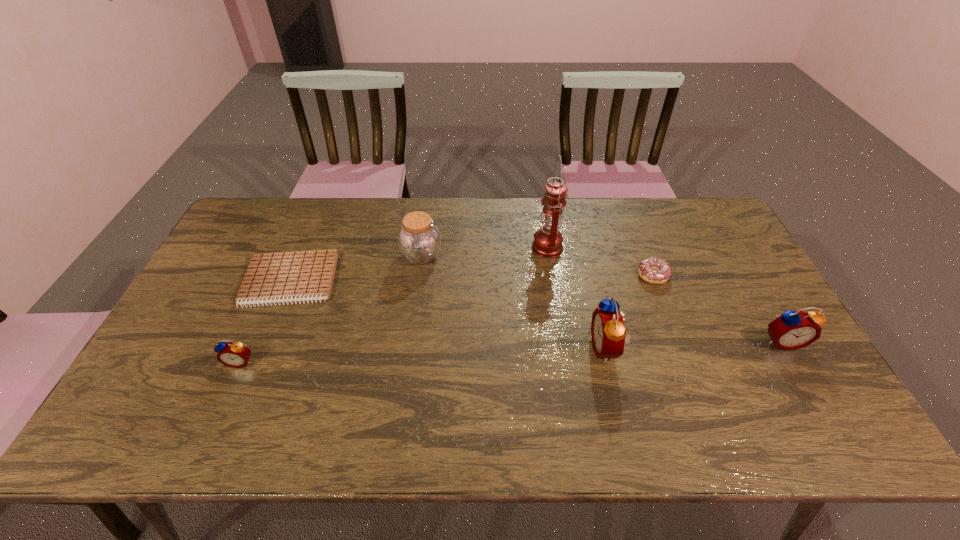
Locate an element on the screen. This screenshot has width=960, height=540. the third object from left to right is located at coordinates (419, 240).

Locate an element on the screen. The image size is (960, 540). free space located on the front-facing side of the second alarm clock from left to right is located at coordinates (554, 348).

I want to click on free space located 0.100m on the front-facing side of the second alarm clock from left to right, so [554, 348].

Find the location of `vacant space located on the front-facing side of the second alarm clock from left to right`. vacant space located on the front-facing side of the second alarm clock from left to right is located at coordinates (505, 348).

Find the location of `vacant space located 0.140m on the front-facing side of the rightmost alarm clock`. vacant space located 0.140m on the front-facing side of the rightmost alarm clock is located at coordinates (816, 400).

At what (x,y) coordinates should I click in order to perform the action: click on free space located on the front of the oil lamp. Please return your answer as a coordinate pair (x, y). Looking at the image, I should click on (552, 274).

Locate an element on the screen. This screenshot has width=960, height=540. vacant space located 0.110m on the right of the shortest object is located at coordinates coord(372,281).

Locate an element on the screen. This screenshot has height=540, width=960. free region located on the right of the doughnut is located at coordinates (728, 275).

At what (x,y) coordinates should I click in order to perform the action: click on vacant space situated on the front of the fifth object from right to left. Please return your answer as a coordinate pair (x, y). This screenshot has height=540, width=960. Looking at the image, I should click on (404, 381).

Where is `oil lamp that is at the far edge`? The image size is (960, 540). oil lamp that is at the far edge is located at coordinates (548, 241).